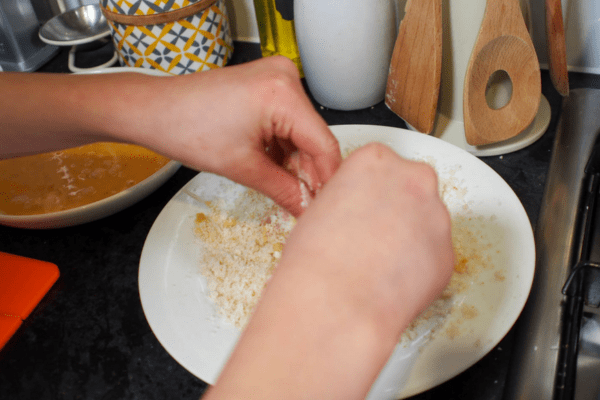
The image size is (600, 400). In order to click on jar of oil in this screenshot , I will do `click(266, 24)`.